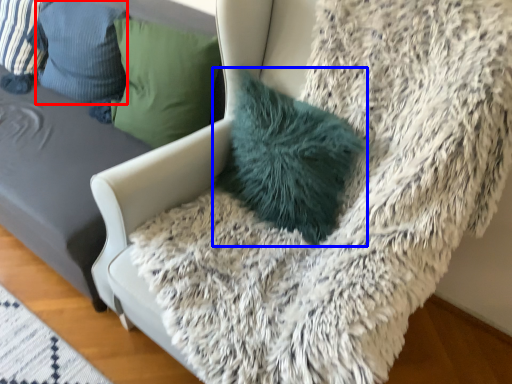
Question: Which object appears closest to the camera in this image, pillow (highlighted by a red box) or pillow (highlighted by a blue box)?

Choices:
 (A) pillow
 (B) pillow

Answer: (B)